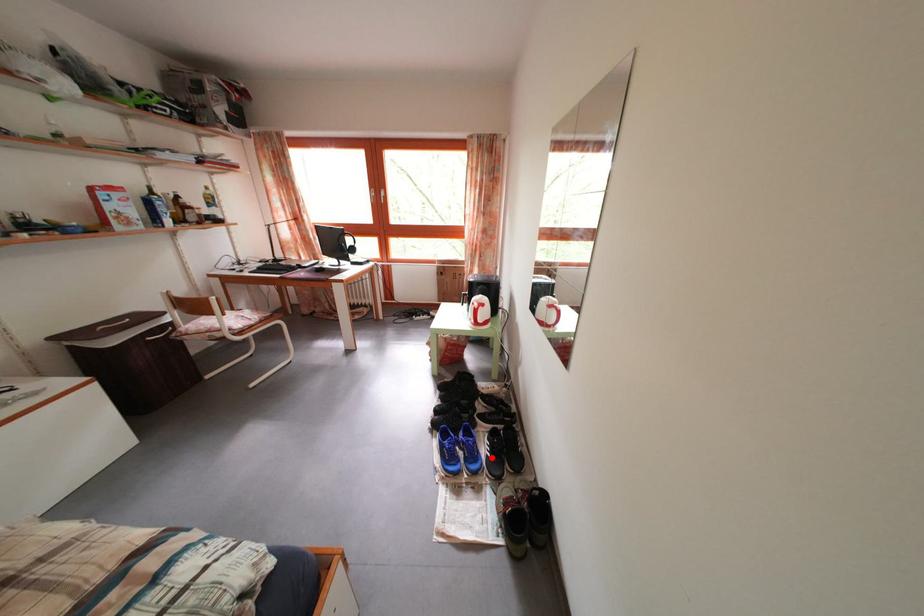
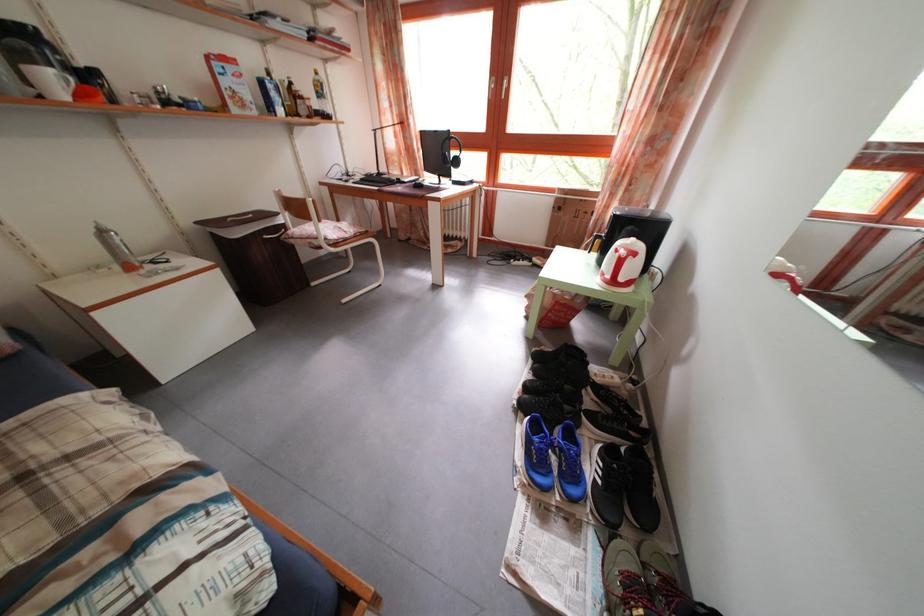
Where in the second image is the point corresponding to the highlighted location from the first image?

(599, 477)